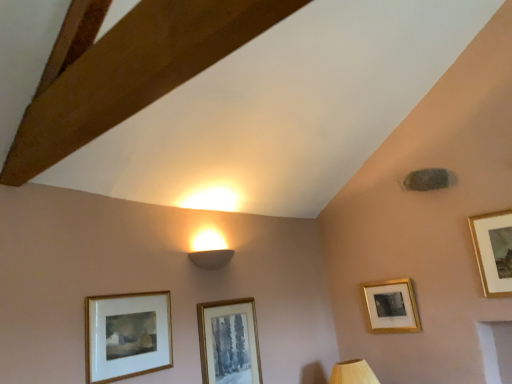
What do you see at coordinates (228, 339) in the screenshot? Image resolution: width=512 pixels, height=384 pixels. I see `matte gold picture frame at center, which is counted as the third picture frame, starting from the back` at bounding box center [228, 339].

The width and height of the screenshot is (512, 384). Describe the element at coordinates (493, 251) in the screenshot. I see `gold-framed picture at upper right, the fourth picture frame viewed from the left` at that location.

Describe the element at coordinates (352, 373) in the screenshot. I see `wooden at lower right` at that location.

Image resolution: width=512 pixels, height=384 pixels. Describe the element at coordinates (127, 335) in the screenshot. I see `gold-framed picture at lower left, the 1th picture frame from the front` at that location.

Measure the distance between point (405, 323) and camera.

The depth of point (405, 323) is 2.79 meters.

What do you see at coordinates (211, 258) in the screenshot? I see `white matte wall sconce at upper center` at bounding box center [211, 258].

This screenshot has width=512, height=384. In order to click on matte gold picture frame at center, the 2th picture frame positioned from the left in this screenshot , I will do `click(228, 339)`.

Between gold-framed picture at upper right, marked as the 2th picture frame in a back-to-front arrangement, and wooden at lower right, which one has larger size?

wooden at lower right is bigger.

Which object is thinner, gold-framed picture at upper right, which ranks as the 1th picture frame in right-to-left order, or wooden at lower right?

gold-framed picture at upper right, which ranks as the 1th picture frame in right-to-left order.

Does point (490, 228) come in front of point (357, 362)?

Yes, it is.

Can we say gold-framed picture at upper right, marked as the 2th picture frame in a back-to-front arrangement, lies outside wooden at lower right?

Indeed, gold-framed picture at upper right, marked as the 2th picture frame in a back-to-front arrangement, is completely outside wooden at lower right.

Is gold-framed picture at upper right, marked as the 2th picture frame in a back-to-front arrangement, touching gold-framed picture at lower left, marked as the fourth picture frame in a right-to-left arrangement?

No, gold-framed picture at upper right, marked as the 2th picture frame in a back-to-front arrangement, is not making contact with gold-framed picture at lower left, marked as the fourth picture frame in a right-to-left arrangement.

Visually, is gold-framed picture at upper right, the fourth picture frame viewed from the left, positioned to the left or to the right of gold-framed picture at lower left, placed as the 1th picture frame when sorted from left to right?

From the image, it's evident that gold-framed picture at upper right, the fourth picture frame viewed from the left, is to the right of gold-framed picture at lower left, placed as the 1th picture frame when sorted from left to right.

From a real-world perspective, is gold-framed picture at upper right, marked as the 2th picture frame in a back-to-front arrangement, positioned over gold-framed picture at lower left, marked as the fourth picture frame in a right-to-left arrangement, based on gravity?

Correct, in the physical world, gold-framed picture at upper right, marked as the 2th picture frame in a back-to-front arrangement, is higher than gold-framed picture at lower left, marked as the fourth picture frame in a right-to-left arrangement.

Does gold-framed picture at upper right, which ranks as the 1th picture frame in right-to-left order, have a greater height compared to gold-framed picture at lower left, which is counted as the fourth picture frame, starting from the back?

Yes, gold-framed picture at upper right, which ranks as the 1th picture frame in right-to-left order, is taller than gold-framed picture at lower left, which is counted as the fourth picture frame, starting from the back.

Which is behind, point (206, 266) or point (86, 366)?

The point (206, 266) is more distant.

Identify the location of the 1st picture frame below when counting from the white matte wall sconce at upper center (from the image's perspective). (127, 335).

Between white matte wall sconce at upper center and gold-framed picture at lower left, the 1th picture frame from the front, which one has smaller width?

Thinner between the two is gold-framed picture at lower left, the 1th picture frame from the front.

Is white matte wall sconce at upper center taller or shorter than gold-framed picture at lower left, the 1th picture frame from the front?

Clearly, white matte wall sconce at upper center is shorter compared to gold-framed picture at lower left, the 1th picture frame from the front.

Between gold-framed picture at lower right, placed as the first picture frame when sorted from back to front, and white matte wall sconce at upper center, which one has larger width?

white matte wall sconce at upper center.

Is gold-framed picture at lower right, which appears as the 4th picture frame when viewed from the front, looking in the opposite direction of white matte wall sconce at upper center?

No, gold-framed picture at lower right, which appears as the 4th picture frame when viewed from the front, is not facing the opposite direction of white matte wall sconce at upper center.

Are gold-framed picture at lower right, placed as the first picture frame when sorted from back to front, and white matte wall sconce at upper center far apart?

gold-framed picture at lower right, placed as the first picture frame when sorted from back to front, is far away from white matte wall sconce at upper center.

Is point (393, 299) positioned before point (221, 264)?

No.

Would you say gold-framed picture at lower left, placed as the 1th picture frame when sorted from left to right, is a long distance from gold-framed picture at lower right, the 3th picture frame in the left-to-right sequence?

Absolutely, gold-framed picture at lower left, placed as the 1th picture frame when sorted from left to right, is distant from gold-framed picture at lower right, the 3th picture frame in the left-to-right sequence.

From a real-world perspective, count 1st picture frames upward from the gold-framed picture at lower right, the 3th picture frame in the left-to-right sequence, and point to it. Please provide its 2D coordinates.

[(127, 335)]

Is point (110, 360) positioned after point (374, 313)?

No.

Is gold-framed picture at lower left, which is counted as the fourth picture frame, starting from the back, closer to the viewer compared to gold-framed picture at lower right, the 2th picture frame viewed from the right?

Yes, the depth of gold-framed picture at lower left, which is counted as the fourth picture frame, starting from the back, is less than that of gold-framed picture at lower right, the 2th picture frame viewed from the right.

Does white matte wall sconce at upper center have a smaller size compared to gold-framed picture at lower right, the 3th picture frame in the left-to-right sequence?

Yes, white matte wall sconce at upper center is smaller than gold-framed picture at lower right, the 3th picture frame in the left-to-right sequence.

Is gold-framed picture at lower right, which appears as the 4th picture frame when viewed from the front, inside white matte wall sconce at upper center?

Actually, gold-framed picture at lower right, which appears as the 4th picture frame when viewed from the front, is outside white matte wall sconce at upper center.

Is white matte wall sconce at upper center in front of or behind gold-framed picture at lower right, the 3th picture frame in the left-to-right sequence, in the image?

In the image, white matte wall sconce at upper center appears in front of gold-framed picture at lower right, the 3th picture frame in the left-to-right sequence.

Is white matte wall sconce at upper center taller or shorter than gold-framed picture at lower right, the 3th picture frame in the left-to-right sequence?

In the image, white matte wall sconce at upper center appears to be shorter than gold-framed picture at lower right, the 3th picture frame in the left-to-right sequence.

Which is closer, (166, 334) or (503, 293)?

Point (166, 334) is positioned closer to the camera compared to point (503, 293).

Considering the relative sizes of gold-framed picture at lower left, which is counted as the fourth picture frame, starting from the back, and gold-framed picture at upper right, which ranks as the 1th picture frame in right-to-left order, in the image provided, is gold-framed picture at lower left, which is counted as the fourth picture frame, starting from the back, smaller than gold-framed picture at upper right, which ranks as the 1th picture frame in right-to-left order,?

Correct, gold-framed picture at lower left, which is counted as the fourth picture frame, starting from the back, occupies less space than gold-framed picture at upper right, which ranks as the 1th picture frame in right-to-left order.

From a real-world perspective, who is located lower, gold-framed picture at lower left, the 1th picture frame from the front, or gold-framed picture at upper right, the fourth picture frame viewed from the left?

gold-framed picture at lower left, the 1th picture frame from the front, is physically lower.

Can you see gold-framed picture at lower left, placed as the 1th picture frame when sorted from left to right, touching gold-framed picture at upper right, which is the third picture frame in front-to-back order?

No, gold-framed picture at lower left, placed as the 1th picture frame when sorted from left to right, is not with gold-framed picture at upper right, which is the third picture frame in front-to-back order.

From a real-world perspective, which picture frame is the 4th one above the wooden at lower right? Please provide its 2D coordinates.

[(493, 251)]

The width and height of the screenshot is (512, 384). Identify the location of the 3rd picture frame to the left of the gold-framed picture at upper right, marked as the 2th picture frame in a back-to-front arrangement, starting your count from the anchor. (127, 335).

Considering their positions, is gold-framed picture at lower right, placed as the first picture frame when sorted from back to front, positioned further to white matte wall sconce at upper center than wooden at lower right?

Among the two, gold-framed picture at lower right, placed as the first picture frame when sorted from back to front, is located further to white matte wall sconce at upper center.

From the picture: From the image, which object appears to be farther from white matte wall sconce at upper center, wooden at lower right or gold-framed picture at lower left, marked as the fourth picture frame in a right-to-left arrangement?

wooden at lower right is further to white matte wall sconce at upper center.

When comparing their distances from gold-framed picture at upper right, which is the third picture frame in front-to-back order, does wooden at lower right or gold-framed picture at lower right, the 2th picture frame viewed from the right, seem closer?

gold-framed picture at lower right, the 2th picture frame viewed from the right, is positioned closer to the anchor gold-framed picture at upper right, which is the third picture frame in front-to-back order.

Estimate the real-world distances between objects in this image. Which object is further from matte gold picture frame at center, which appears as the 3th picture frame when viewed from the right, gold-framed picture at upper right, which ranks as the 1th picture frame in right-to-left order, or gold-framed picture at lower right, the 2th picture frame viewed from the right?

The object further to matte gold picture frame at center, which appears as the 3th picture frame when viewed from the right, is gold-framed picture at upper right, which ranks as the 1th picture frame in right-to-left order.

Looking at the image, which one is located closer to wooden at lower right, gold-framed picture at lower left, which is counted as the fourth picture frame, starting from the back, or matte gold picture frame at center, the 2th picture frame positioned from the left?

matte gold picture frame at center, the 2th picture frame positioned from the left, is positioned closer to the anchor wooden at lower right.

When comparing their distances from white matte wall sconce at upper center, does wooden at lower right or gold-framed picture at upper right, which ranks as the 1th picture frame in right-to-left order, seem closer?

Based on the image, wooden at lower right appears to be nearer to white matte wall sconce at upper center.

Based on their spatial positions, is white matte wall sconce at upper center or wooden at lower right further from gold-framed picture at upper right, the fourth picture frame viewed from the left?

Based on the image, white matte wall sconce at upper center appears to be further to gold-framed picture at upper right, the fourth picture frame viewed from the left.

Based on their spatial positions, is white matte wall sconce at upper center or matte gold picture frame at center, the 2th picture frame positioned from the left, further from gold-framed picture at lower right, the 2th picture frame viewed from the right?

Among the two, white matte wall sconce at upper center is located further to gold-framed picture at lower right, the 2th picture frame viewed from the right.

Find the location of `picture frame between white matte wall sconce at upper center and wooden at lower right`. picture frame between white matte wall sconce at upper center and wooden at lower right is located at coordinates (228, 339).

What are the coordinates of `table lamp located between white matte wall sconce at upper center and gold-framed picture at upper right, which ranks as the 1th picture frame in right-to-left order, in the left-right direction` in the screenshot? It's located at (352, 373).

What are the coordinates of `table lamp between gold-framed picture at lower left, which is counted as the fourth picture frame, starting from the back, and gold-framed picture at upper right, which is the third picture frame in front-to-back order, in the horizontal direction` in the screenshot? It's located at (352, 373).

Locate an element on the screen. This screenshot has height=384, width=512. lamp between gold-framed picture at lower left, which is counted as the fourth picture frame, starting from the back, and gold-framed picture at lower right, the 3th picture frame in the left-to-right sequence, in the horizontal direction is located at coordinates (211, 258).